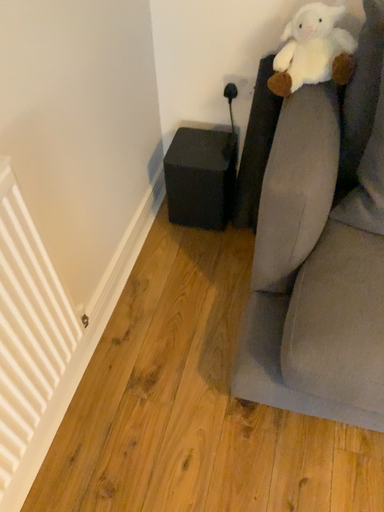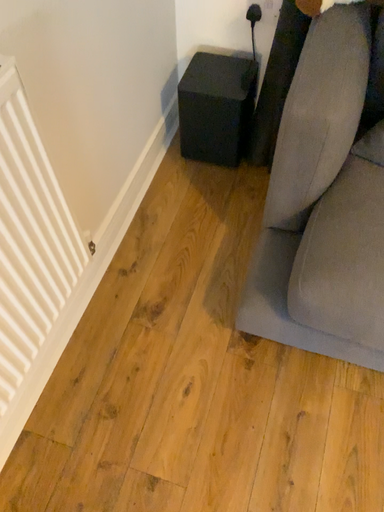
Question: How did the camera likely rotate when shooting the video?

Choices:
 (A) rotated upward
 (B) rotated downward

Answer: (B)